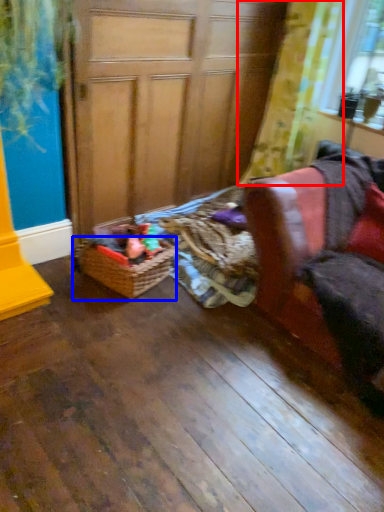
Question: Which point is further to the camera, curtain (highlighted by a red box) or basket (highlighted by a blue box)?

Choices:
 (A) curtain
 (B) basket

Answer: (A)